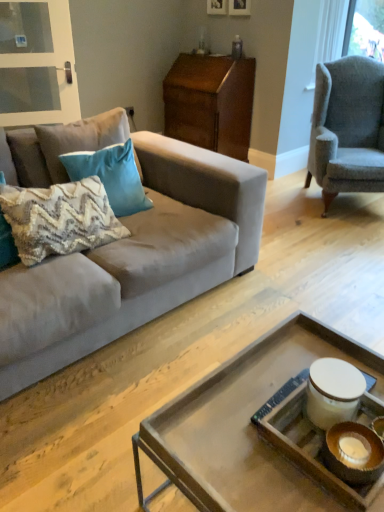
The height and width of the screenshot is (512, 384). Identify the location of free space in front of gray woolen armchair at right. (337, 240).